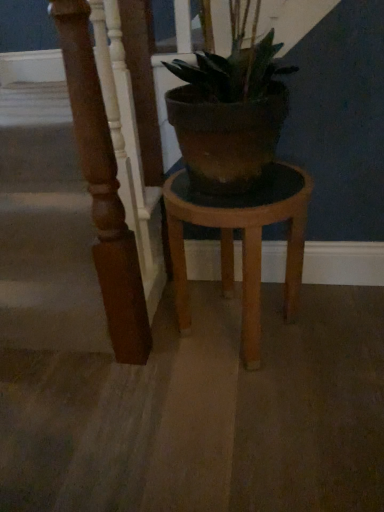
This screenshot has height=512, width=384. What are the coordinates of `free location in front of wooden stool at center` in the screenshot? It's located at (250, 421).